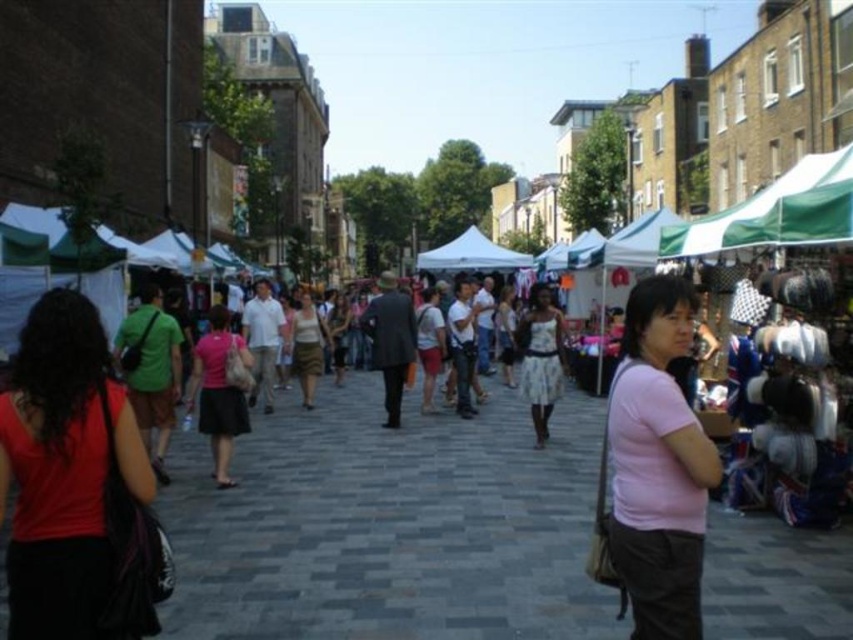
Question: Does pink matte shirt at center appear on the left side of matte gray coat at center?

Choices:
 (A) yes
 (B) no

Answer: (B)

Question: Which object appears closest to the camera in this image?

Choices:
 (A) white floral dress at center
 (B) green fabric canopy at upper right

Answer: (B)

Question: Is pink matte shirt at center above pink fabric skirt at center?

Choices:
 (A) no
 (B) yes

Answer: (A)

Question: Estimate the real-world distances between objects in this image. Which object is farther from the matte red tank top at left?

Choices:
 (A) matte gray coat at center
 (B) pink matte shirt at center
 (C) pink fabric skirt at center

Answer: (A)

Question: Can you confirm if pink fabric skirt at center is positioned above white fabric canopy at center?

Choices:
 (A) yes
 (B) no

Answer: (B)

Question: Considering the real-world distances, which object is closest to the matte white blouse at center?

Choices:
 (A) white floral dress at center
 (B) matte red tank top at left

Answer: (A)